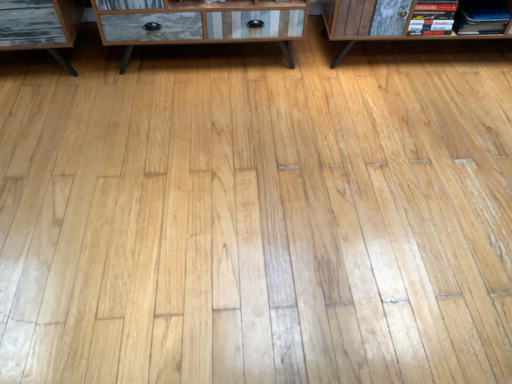
Question: Would you say wooden cabinet at center is inside or outside matte black book at upper right, the second book from the left?

Choices:
 (A) outside
 (B) inside

Answer: (A)

Question: From the image's perspective, is wooden cabinet at center located above or below matte black book at upper right, the second book from the left?

Choices:
 (A) above
 (B) below

Answer: (A)

Question: Based on their relative distances, which object is nearer to the wooden cabinet at center?

Choices:
 (A) hardcover book at upper right, placed as the second book when sorted from right to left
 (B) matte black book at upper right, which ranks as the 1th book in right-to-left order

Answer: (A)

Question: Estimate the real-world distances between objects in this image. Which object is closer to the matte black book at upper right, the second book from the left?

Choices:
 (A) wooden cabinet at center
 (B) hardcover book at upper right, placed as the second book when sorted from right to left

Answer: (B)